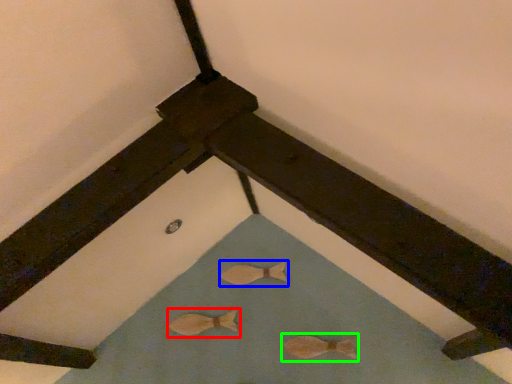
Question: Estimate the real-world distances between objects in this image. Which object is closer to animal (highlighted by a red box), animal (highlighted by a blue box) or animal (highlighted by a green box)?

Choices:
 (A) animal
 (B) animal

Answer: (A)